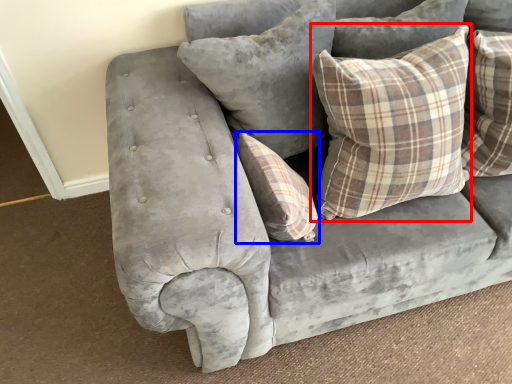
Question: Which point is further to the camera, pillow (highlighted by a red box) or pillow (highlighted by a blue box)?

Choices:
 (A) pillow
 (B) pillow

Answer: (B)